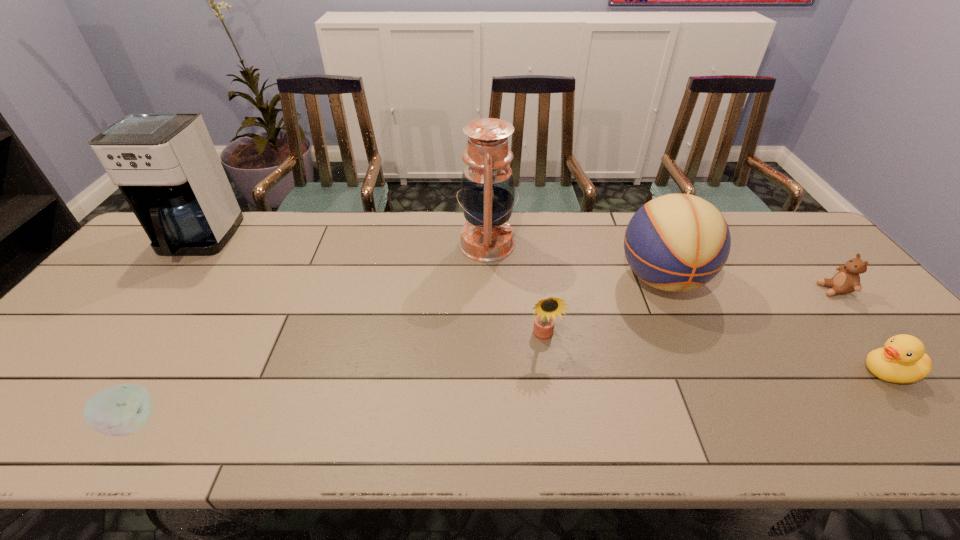
Find the location of a particular element. This screenshot has width=960, height=540. free space located on the left of the oil lamp is located at coordinates (334, 245).

You are a GUI agent. You are given a task and a screenshot of the screen. Output one action in this format:
    pyautogui.click(x=<x>, y=<y>)
    Task: Click on the blank area located 0.230m on the front panel of the leftmost object
    The image size is (960, 540).
    Given the screenshot: What is the action you would take?
    pyautogui.click(x=131, y=326)

Identify the location of vacant area situated on the patterned surface of the fifth object from left to right. (716, 399).

I want to click on free space located on the face of the fifth farthest object, so click(551, 394).

At what (x,y) coordinates should I click in order to perform the action: click on vacant space located on the front-facing side of the teddy bear. Please return your answer as a coordinate pair (x, y). The image size is (960, 540). Looking at the image, I should click on (698, 290).

Identify the location of blank space located on the front-facing side of the teddy bear. (744, 290).

The width and height of the screenshot is (960, 540). Find the location of `free location located on the front-facing side of the teddy bear`. free location located on the front-facing side of the teddy bear is located at coordinates (684, 290).

The image size is (960, 540). I want to click on vacant area located at the beak of the duck, so (x=714, y=372).

Identify the location of free space located 0.120m at the beak of the duck. (809, 372).

You are a GUI agent. You are given a task and a screenshot of the screen. Output one action in this format:
    pyautogui.click(x=<x>, y=<y>)
    Task: Click on the vacant space located 0.340m at the beak of the duck
    This screenshot has height=540, width=960.
    Given the screenshot: What is the action you would take?
    pyautogui.click(x=714, y=372)